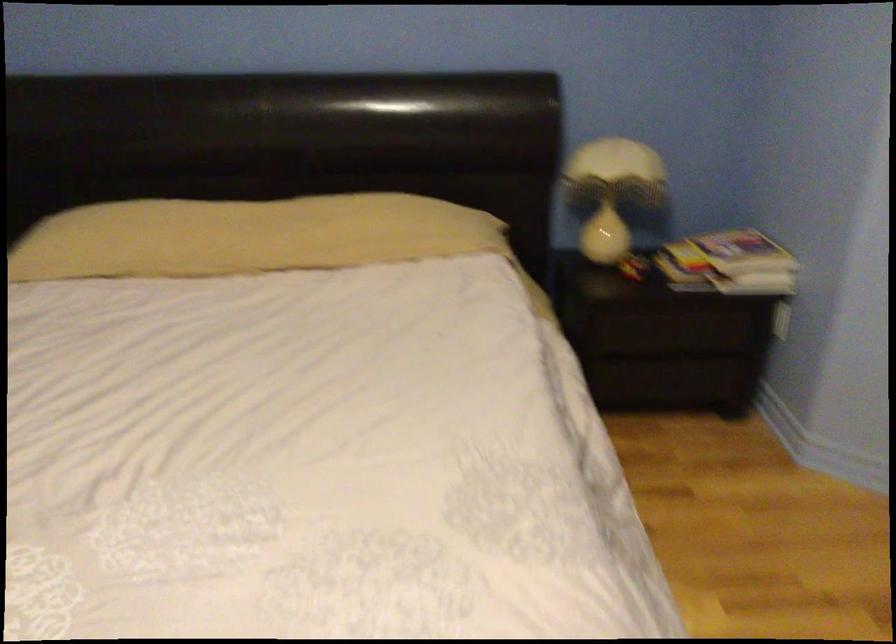
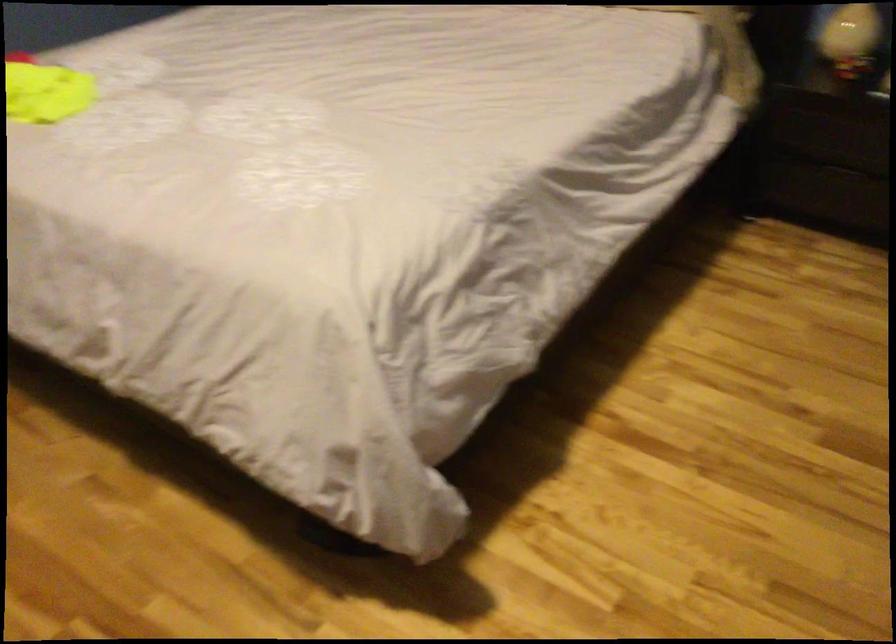
Locate, in the second image, the point that corresponds to the point at 622,241 in the first image.

(851, 39)